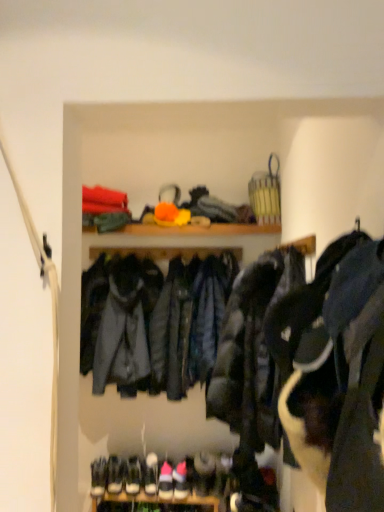
The height and width of the screenshot is (512, 384). I want to click on blank space above white suede sneakers at lower center, placed as the first footwear when sorted from right to left (from a real-world perspective), so click(x=190, y=467).